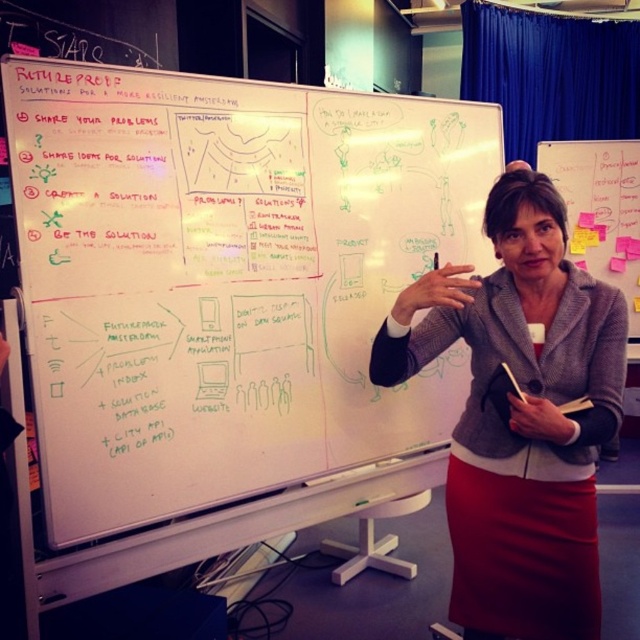
You are standing at the camera position and want to reach the point marked at coordinates (125, 108). If you take a step forward of 3 feet, will you be closer than 2 feet to that point?

The point marked at coordinates (125, 108) is 4.89 feet away. After stepping forward 3 feet, you would be 1.89 feet away, which is closer than 2 feet.

You are a photographer holding a camera 1.34 meters away from the whiteboard at upper center. You want to capture the entire whiteboard in one shot without moving the camera. What adjustment should you make to your camera settings?

To capture the entire whiteboard at upper center in one shot without moving the camera, you should use a wide angle lens. Since the distance between the camera and the whiteboard at upper center is 1.34 meters, a wide angle lens will allow you to capture more of the whiteboard in the frame.

You are an interior designer assessing the space for future events. The whiteboard at upper center and the gray woolen blazer at center are both in the room. Which object is wider?

The whiteboard at upper center is wider than the gray woolen blazer at center.